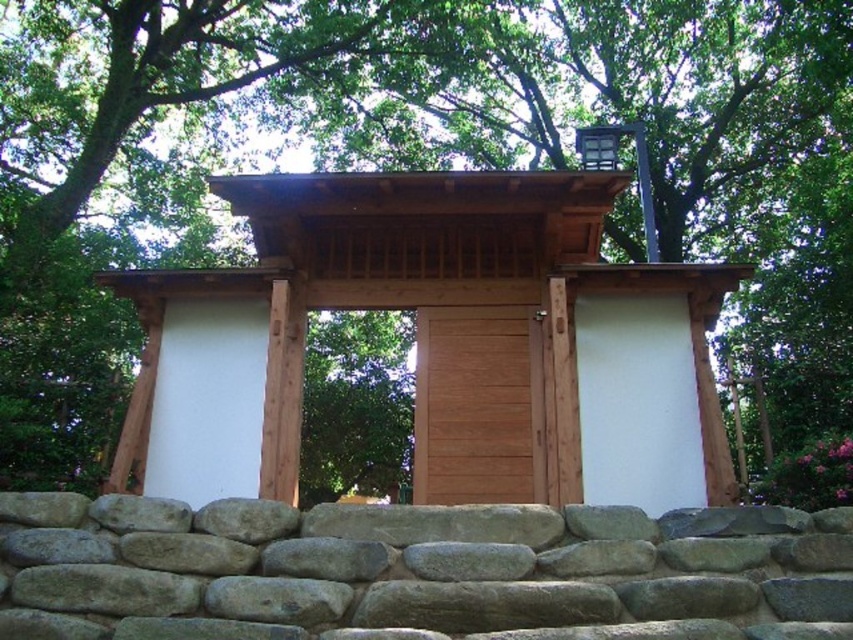
You are standing in front of the wooden structure and want to place a small potted plant between the gray rough stone wall at lower center and the wooden door at center. Which object should you place the plant closer to in order to have it near the stone wall?

You should place the plant closer to the gray rough stone wall at lower center because it is nearer to the viewer than the wooden door at center.

You are a painter standing at the entrance of the wooden structure. You want to paint both the wooden gate at center and the gray rough stone wall at lower center. Which object requires less paint due to its smaller surface area?

The wooden gate at center requires less paint because it is thinner than the gray rough stone wall at lower center, meaning it has a smaller surface area.

You are standing in front of the wooden structure and want to enter through the wooden door at center. There is a wooden gate at center in front of it. Which object should you open first to reach the door?

You should open the wooden gate at center first because it is closer to you and in front of the wooden door at center, allowing access to the door.